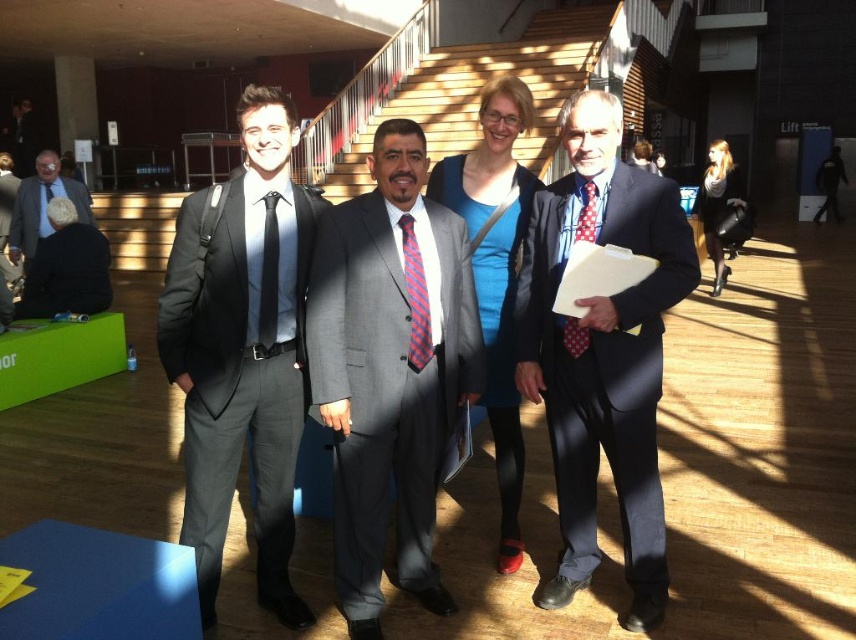
Can you confirm if dark blue suit at center is bigger than black suit at left?

Correct, dark blue suit at center is larger in size than black suit at left.

Does point (568, 582) come closer to viewer compared to point (33, 280)?

Yes, point (568, 582) is in front of point (33, 280).

Is point (623, 515) positioned before point (58, 232)?

Yes, it is.

Where is `dark blue suit at center`? dark blue suit at center is located at coordinates (602, 352).

Can you confirm if black suit at left is thinner than blonde hair at upper right?

No.

Is black suit at left behind blonde hair at upper right?

No, it is in front of blonde hair at upper right.

This screenshot has height=640, width=856. In order to click on black suit at left in this screenshot , I will do `click(66, 268)`.

Where is `black suit at left`? The height and width of the screenshot is (640, 856). black suit at left is located at coordinates (66, 268).

Is point (268, 333) positioned in front of point (15, 200)?

That is True.

Does point (165, 298) come behind point (16, 241)?

No, (165, 298) is closer to viewer.

This screenshot has width=856, height=640. I want to click on gray wool suit at left, so click(x=241, y=369).